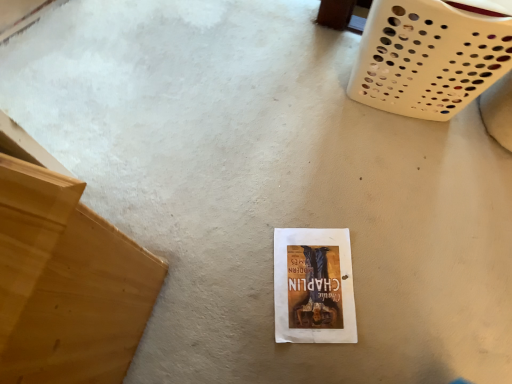
Find the location of a particular element. free space to the back side of light brown wood at left is located at coordinates (131, 170).